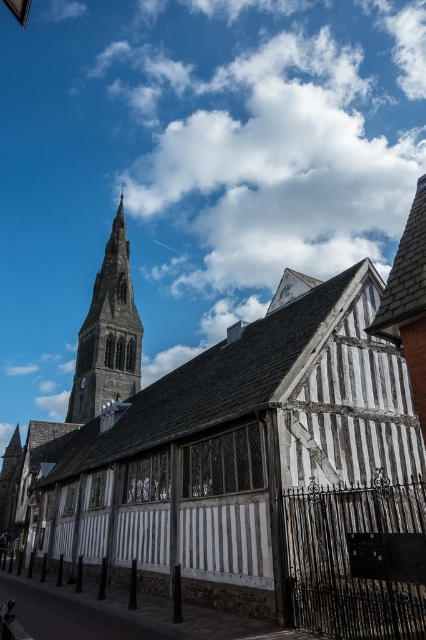
Question: Among these points, which one is nearest to the camera?

Choices:
 (A) (81, 410)
 (B) (261, 460)

Answer: (B)

Question: In this image, where is white timber-framed building at center located relative to dark gray stone tower at upper left?

Choices:
 (A) above
 (B) below

Answer: (B)

Question: Which of the following is the farthest from the observer?

Choices:
 (A) (192, 433)
 (B) (80, 355)

Answer: (B)

Question: Does white timber-framed building at center appear on the right side of dark gray stone tower at upper left?

Choices:
 (A) no
 (B) yes

Answer: (B)

Question: Is white timber-framed building at center further to camera compared to dark gray stone tower at upper left?

Choices:
 (A) no
 (B) yes

Answer: (A)